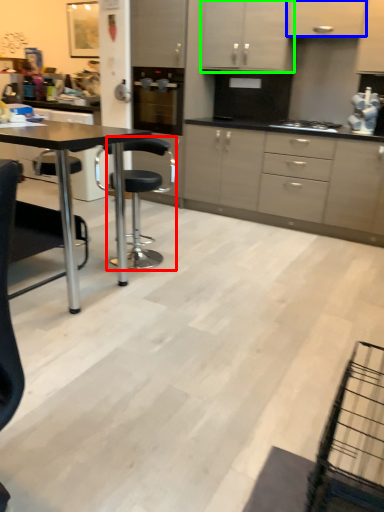
Question: Which is nearer to the chair (highlighted by a red box)? cabinetry (highlighted by a blue box) or cabinetry (highlighted by a green box).

Choices:
 (A) cabinetry
 (B) cabinetry

Answer: (B)